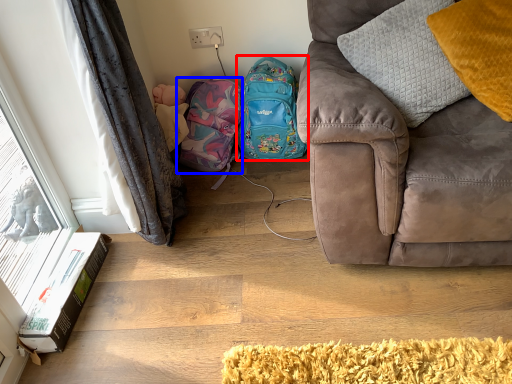
Question: Which of the following is the closest to the observer, backpack (highlighted by a red box) or bag (highlighted by a blue box)?

Choices:
 (A) backpack
 (B) bag

Answer: (A)